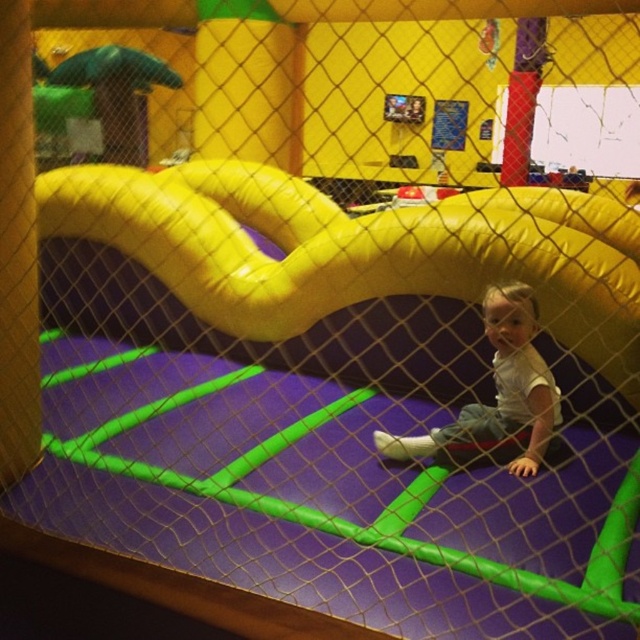
Which is in front, point (260, 204) or point (522, 362)?

Positioned in front is point (522, 362).

Can you confirm if yellow inflatable slide at center is positioned below white matte shirt at center?

No.

Is point (346, 253) closer to camera compared to point (509, 356)?

No, (346, 253) is behind (509, 356).

Where is `yellow inflatable slide at center`? The width and height of the screenshot is (640, 640). yellow inflatable slide at center is located at coordinates (340, 278).